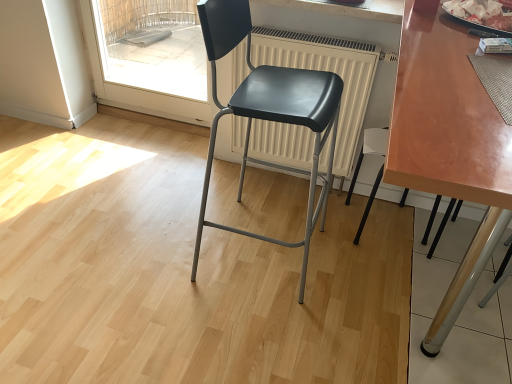
You are a GUI agent. You are given a task and a screenshot of the screen. Output one action in this format:
    pyautogui.click(x=<x>, y=<y>)
    Task: Click on the vacant space underneath shiny brown table at center (from a real-world perspective)
    The width and height of the screenshot is (512, 384).
    Given the screenshot: What is the action you would take?
    pyautogui.click(x=433, y=309)